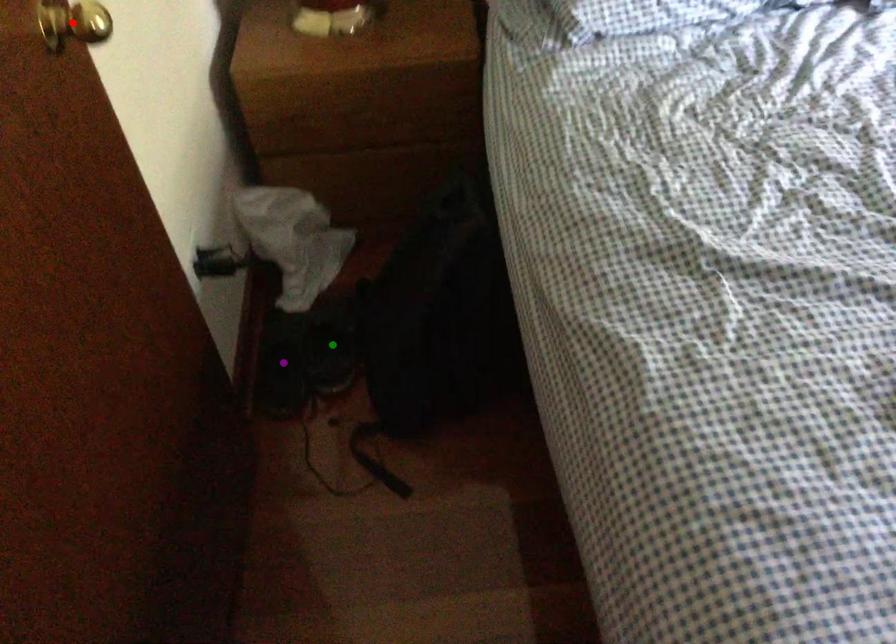
Order these from nearest to farthest:
red point, purple point, green point

red point, purple point, green point